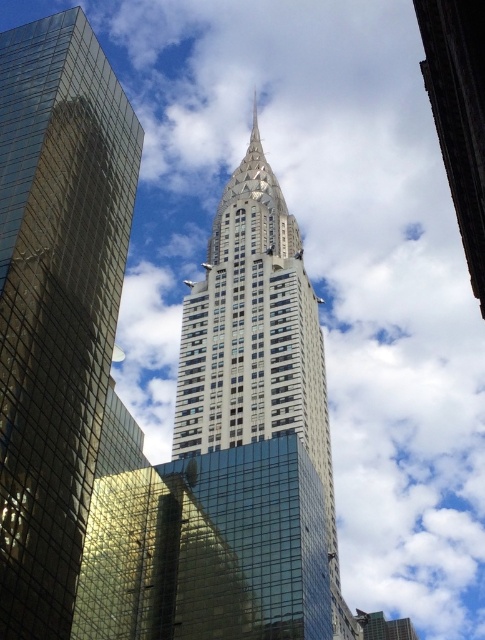
Question: Among these points, which one is farthest from the camera?

Choices:
 (A) (33, 88)
 (B) (255, 179)

Answer: (B)

Question: Is glassy steel skyscraper at center above glassy steel tower at center?

Choices:
 (A) no
 (B) yes

Answer: (A)

Question: Among these objects, which one is nearest to the camera?

Choices:
 (A) glassy steel tower at center
 (B) glassy steel skyscraper at center

Answer: (B)

Question: Which point appears farthest from the camera in this image?

Choices:
 (A) (51, 586)
 (B) (225, 444)

Answer: (B)

Question: Is glassy steel skyscraper at center thinner than glassy steel tower at center?

Choices:
 (A) no
 (B) yes

Answer: (B)

Question: Is glassy steel skyscraper at center positioned before glassy steel tower at center?

Choices:
 (A) yes
 (B) no

Answer: (A)